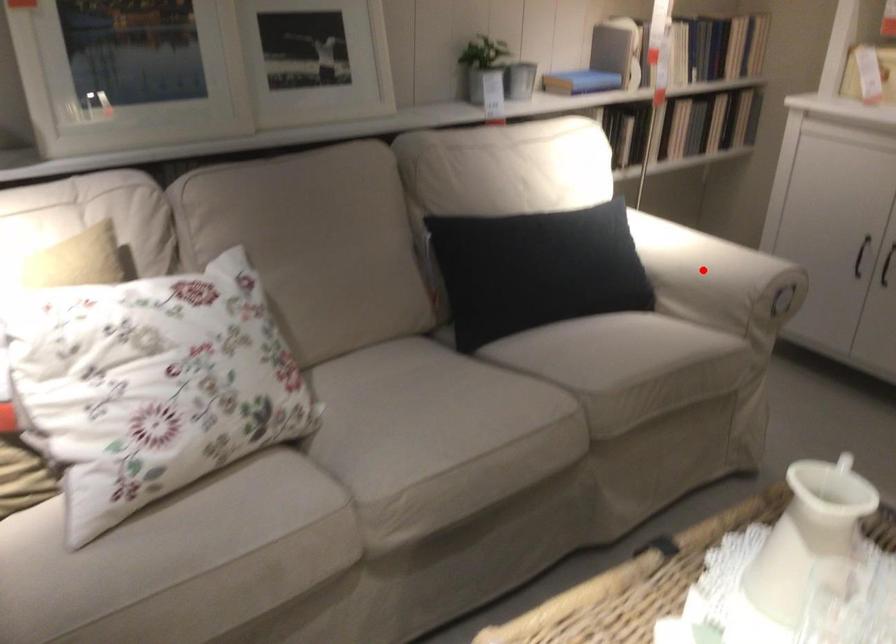
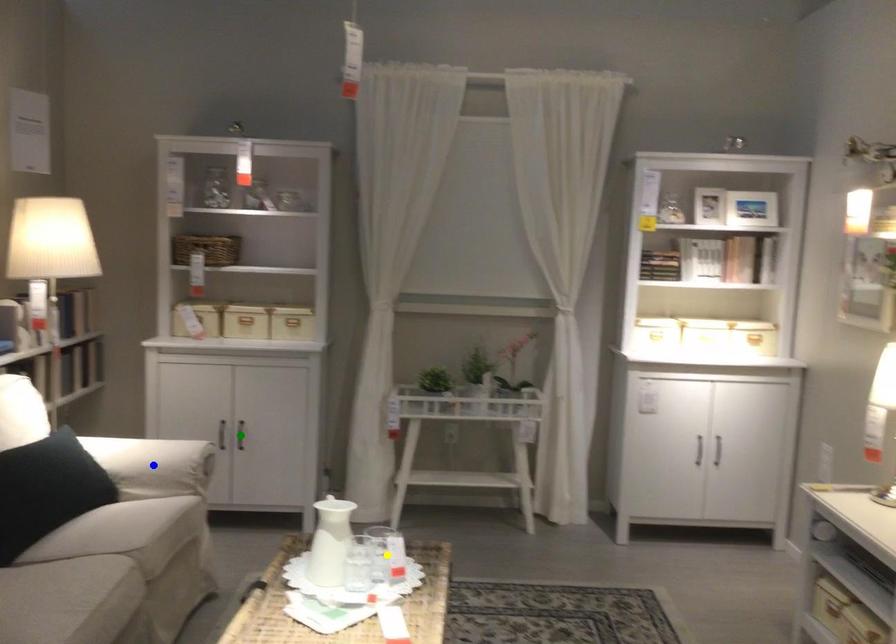
Question: I am providing you with two images of the same scene from different viewpoints. A red point is marked on the first image. You are given multiple points on the second image. Which mark in image 2 goes with the point in image 1?

Choices:
 (A) blue point
 (B) green point
 (C) yellow point

Answer: (A)